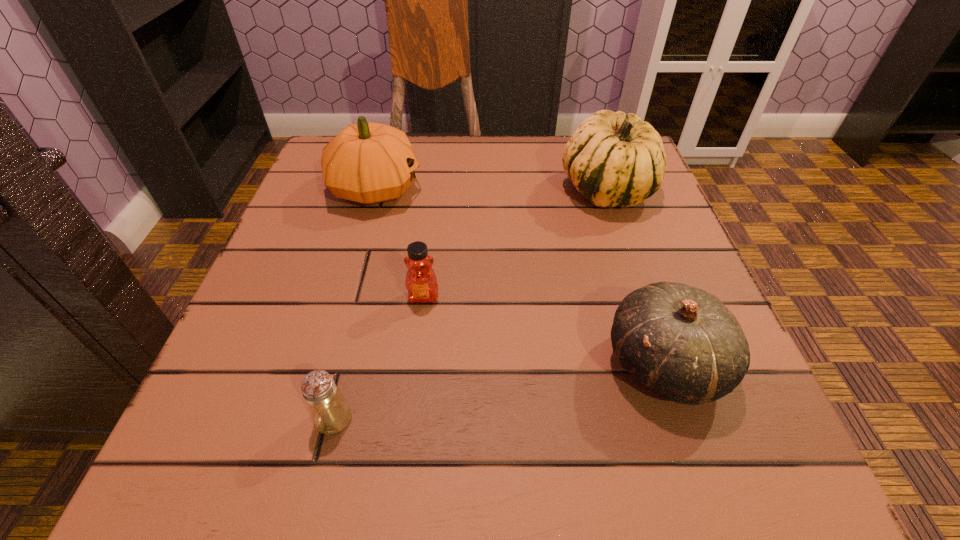
Locate which object ranks fourth in proximity to the leftmost gourd. Please provide its 2D coordinates. Your answer should be formatted as a tuple, i.e. [(x, y)], where the tuple contains the x and y coordinates of a point satisfying the conditions above.

[(330, 412)]

Image resolution: width=960 pixels, height=540 pixels. I want to click on object that is the fourth closest one to the leftmost gourd, so click(330, 412).

This screenshot has height=540, width=960. Identify the location of the second closest gourd relative to the saltshaker. (367, 162).

The width and height of the screenshot is (960, 540). I want to click on the closest gourd to the saltshaker, so click(680, 341).

Where is `vacant space that satisfies the following two spatial constraints: 1. on the side of the leftmost gourd with the carved face; 2. on the left side of the third tallest object`? The width and height of the screenshot is (960, 540). vacant space that satisfies the following two spatial constraints: 1. on the side of the leftmost gourd with the carved face; 2. on the left side of the third tallest object is located at coordinates (325, 364).

Locate an element on the screen. The image size is (960, 540). vacant space that satisfies the following two spatial constraints: 1. on the side of the nearest gourd with the carved face; 2. on the left side of the leftmost gourd is located at coordinates (325, 364).

You are a GUI agent. You are given a task and a screenshot of the screen. Output one action in this format:
    pyautogui.click(x=<x>, y=<y>)
    Task: Click on the free point that satisfies the following two spatial constraints: 1. on the back side of the saltshaker; 2. on the left side of the third shortest object
    The height and width of the screenshot is (540, 960).
    Given the screenshot: What is the action you would take?
    pyautogui.click(x=348, y=364)

Where is `vacant region that satisfies the following two spatial constraints: 1. on the side of the leftmost gourd with the carved face; 2. on the back side of the nearest gourd`? vacant region that satisfies the following two spatial constraints: 1. on the side of the leftmost gourd with the carved face; 2. on the back side of the nearest gourd is located at coordinates (325, 364).

You are a GUI agent. You are given a task and a screenshot of the screen. Output one action in this format:
    pyautogui.click(x=<x>, y=<y>)
    Task: Click on the vacant region that satisfies the following two spatial constraints: 1. on the side of the shortest gourd with the carved face; 2. on the left side of the leftmost gourd
    
    Given the screenshot: What is the action you would take?
    pyautogui.click(x=325, y=364)

Identify the location of free region that satisfies the following two spatial constraints: 1. on the side of the leftmost gourd with the carved face; 2. on the right side of the saltshaker. (310, 418).